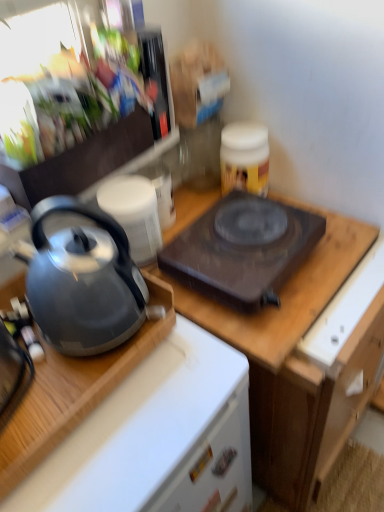
This screenshot has height=512, width=384. In order to click on space that is in front of matte gray kettle at left in this screenshot , I will do `click(132, 434)`.